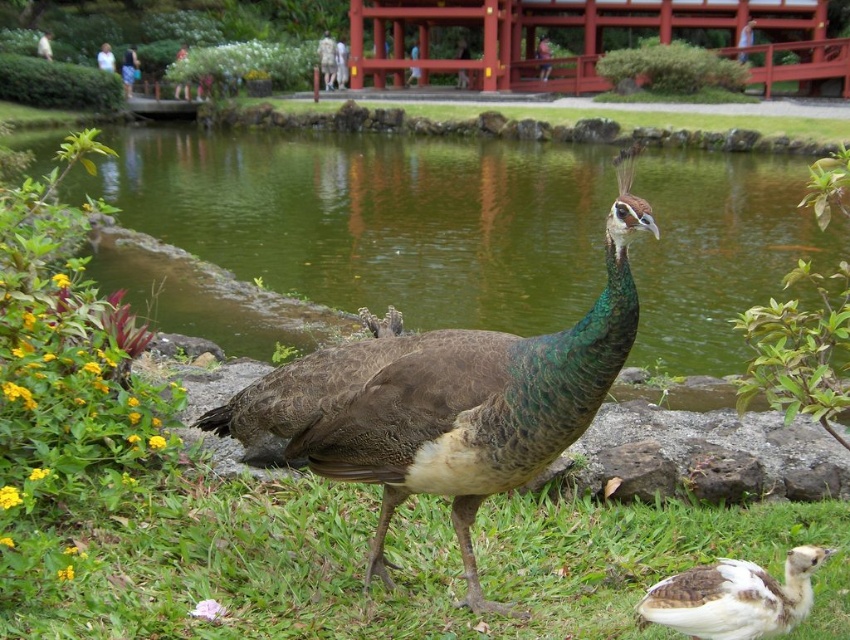
Question: Can you confirm if green feathered peacock at center is positioned below white downy duckling at center?

Choices:
 (A) yes
 (B) no

Answer: (B)

Question: Which point is closer to the camera taking this photo?

Choices:
 (A) (676, 214)
 (B) (642, 605)

Answer: (B)

Question: Is green water at center above green feathered peacock at center?

Choices:
 (A) yes
 (B) no

Answer: (A)

Question: Which of the following is the farthest from the observer?

Choices:
 (A) (511, 262)
 (B) (601, 364)
 (C) (723, 614)

Answer: (A)

Question: Does green water at center have a larger size compared to white downy duckling at center?

Choices:
 (A) no
 (B) yes

Answer: (B)

Question: Which point is farther to the camera?

Choices:
 (A) (830, 554)
 (B) (423, 163)

Answer: (B)